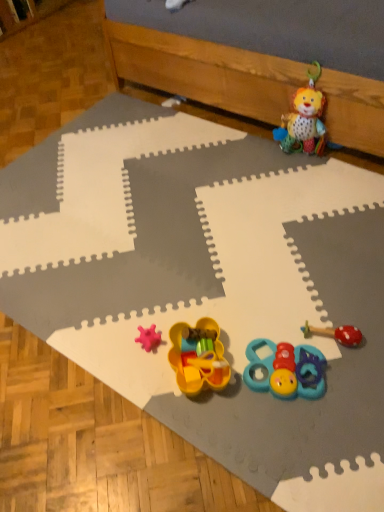
The width and height of the screenshot is (384, 512). Identify the location of spots to the right of red rubber teething ring at lower right, the third toy when ordered from front to back. (369, 318).